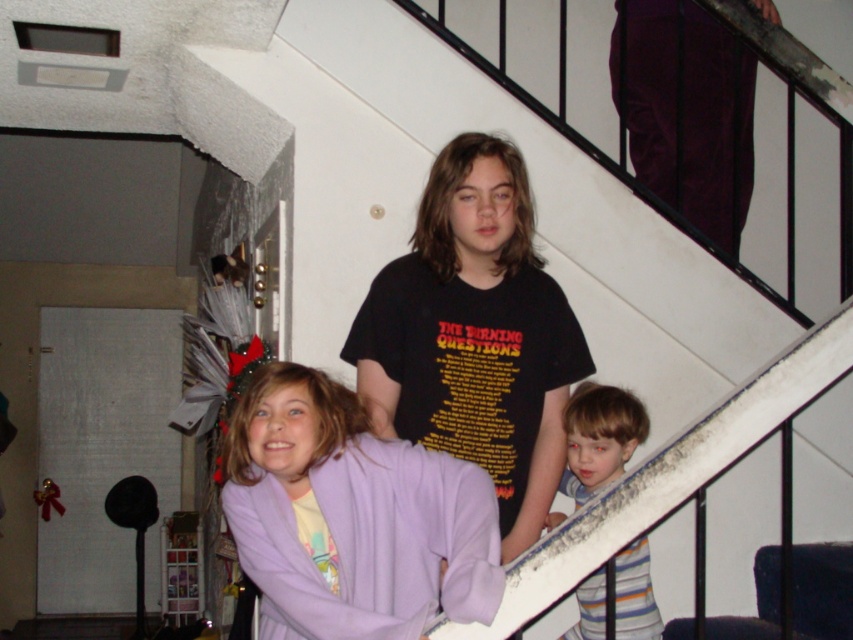
Which is more to the right, white matte stairwell at upper center or striped cotton shirt at lower right?

From the viewer's perspective, striped cotton shirt at lower right appears more on the right side.

Is white matte stairwell at upper center above striped cotton shirt at lower right?

Indeed, white matte stairwell at upper center is positioned over striped cotton shirt at lower right.

Does point (357, 65) come behind point (577, 404)?

Yes, point (357, 65) is farther from viewer.

This screenshot has height=640, width=853. I want to click on white matte stairwell at upper center, so click(x=537, y=218).

Can you confirm if white matte stairwell at upper center is positioned above purple soft fabric at center?

Indeed, white matte stairwell at upper center is positioned over purple soft fabric at center.

Based on the photo, can you confirm if white matte stairwell at upper center is taller than purple soft fabric at center?

Indeed, white matte stairwell at upper center has a greater height compared to purple soft fabric at center.

Find the location of `white matte stairwell at upper center`. white matte stairwell at upper center is located at coordinates pos(537,218).

Does point (316, 630) come closer to viewer compared to point (599, 440)?

Yes.

Which is below, purple soft fabric at center or striped cotton shirt at lower right?

striped cotton shirt at lower right is lower down.

The image size is (853, 640). I want to click on purple soft fabric at center, so click(351, 516).